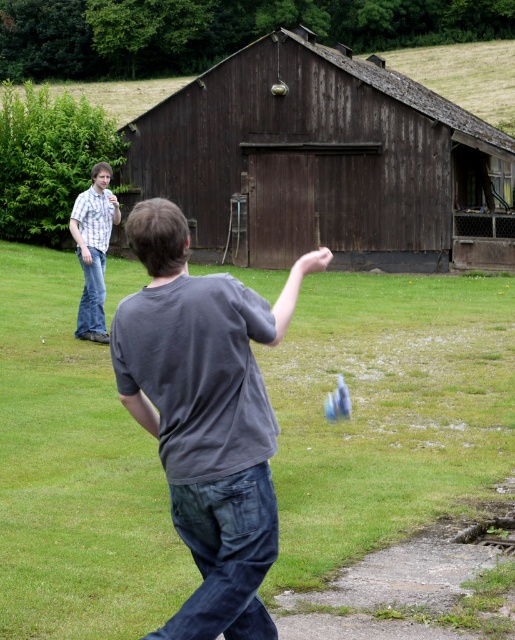
Question: Based on their relative distances, which object is farther from the plaid shirt at left?

Choices:
 (A) dark wood barn at center
 (B) dark gray t-shirt at center

Answer: (A)

Question: Does dark wood barn at center have a larger size compared to dark gray t-shirt at center?

Choices:
 (A) no
 (B) yes

Answer: (B)

Question: Where is dark gray t-shirt at center located in relation to plaid shirt at left in the image?

Choices:
 (A) right
 (B) left

Answer: (A)

Question: Among these points, which one is farthest from the camera?

Choices:
 (A) (425, 113)
 (B) (229, 620)

Answer: (A)

Question: Is dark wood barn at center closer to the viewer compared to plaid shirt at left?

Choices:
 (A) yes
 (B) no

Answer: (B)

Question: Considering the real-world distances, which object is farthest from the plaid shirt at left?

Choices:
 (A) dark wood barn at center
 (B) dark gray t-shirt at center

Answer: (A)